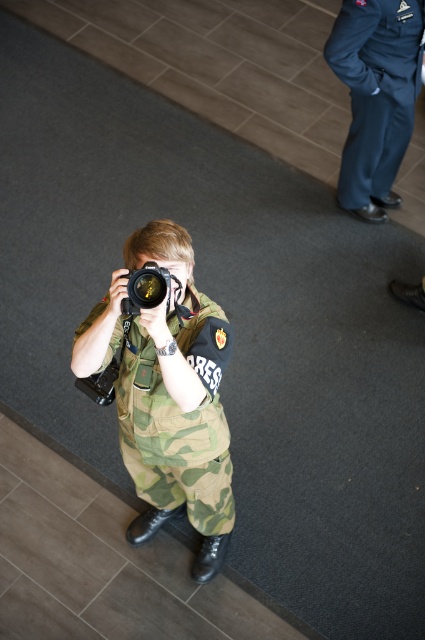
From the picture: You are organizing a press conference and need to arrange seating based on the size of the clothing items. Since the camo fabric uniform at center and navy blue fabric pants at upper right are part of the setup, which one requires more space?

The camo fabric uniform at center requires more space because it is larger in size than the navy blue fabric pants at upper right.

You are a photographer at an event and need to adjust your camera settings based on the lighting. You notice a navy blue fabric pants at upper right in the frame. Where exactly is the navy blue fabric pants at upper right located in relation to the point you marked at coordinate point (x=376, y=96)?

The navy blue fabric pants at upper right is located exactly at the point you marked at coordinate point (x=376, y=96).